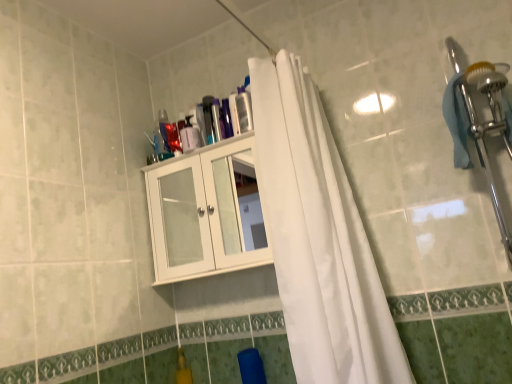
Question: Is transparent plastic bottle at upper center outside of white glossy cabinet at upper center?

Choices:
 (A) yes
 (B) no

Answer: (A)

Question: Can you confirm if transparent plastic bottle at upper center is taller than white glossy cabinet at upper center?

Choices:
 (A) yes
 (B) no

Answer: (B)

Question: Is transparent plastic bottle at upper center further to camera compared to white glossy cabinet at upper center?

Choices:
 (A) no
 (B) yes

Answer: (B)

Question: Is white glossy cabinet at upper center a part of transparent plastic bottle at upper center?

Choices:
 (A) no
 (B) yes

Answer: (A)

Question: Are transparent plastic bottle at upper center and white glossy cabinet at upper center making contact?

Choices:
 (A) no
 (B) yes

Answer: (A)

Question: Does transparent plastic bottle at upper center have a lesser width compared to white glossy cabinet at upper center?

Choices:
 (A) no
 (B) yes

Answer: (B)

Question: Is white fabric curtain at center in front of white glossy cabinet at upper center?

Choices:
 (A) yes
 (B) no

Answer: (A)

Question: Is white fabric curtain at center thinner than white glossy cabinet at upper center?

Choices:
 (A) yes
 (B) no

Answer: (B)

Question: Does white fabric curtain at center appear on the left side of white glossy cabinet at upper center?

Choices:
 (A) yes
 (B) no

Answer: (B)

Question: From a real-world perspective, is white fabric curtain at center located higher than white glossy cabinet at upper center?

Choices:
 (A) no
 (B) yes

Answer: (A)

Question: Is white fabric curtain at center smaller than white glossy cabinet at upper center?

Choices:
 (A) no
 (B) yes

Answer: (A)

Question: Is white fabric curtain at center next to white glossy cabinet at upper center?

Choices:
 (A) no
 (B) yes

Answer: (A)

Question: Would you consider white glossy cabinet at upper center to be distant from transparent plastic bottle at upper center?

Choices:
 (A) yes
 (B) no

Answer: (B)